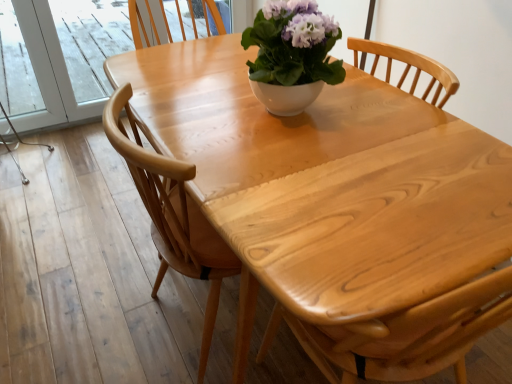
In order to face light wood chair at center, should I rotate leftwards or rightwards?

Turn left by 5.196 degrees to look at light wood chair at center.

Find the location of `natural wood table at center`. natural wood table at center is located at coordinates (328, 188).

You are a GUI agent. You are given a task and a screenshot of the screen. Output one action in this format:
    pyautogui.click(x=<x>, y=<y>)
    Task: Click on the light wood chair at center
    
    Given the screenshot: What is the action you would take?
    pyautogui.click(x=172, y=215)

Considering the relative sizes of light wood chair at center and natural wood table at center in the image provided, is light wood chair at center smaller than natural wood table at center?

Yes.

Could you tell me if light wood chair at center is turned towards natural wood table at center?

No, light wood chair at center is not aimed at natural wood table at center.

Based on the photo, is the surface of light wood chair at center in direct contact with natural wood table at center?

No.

How different are the orientations of light wood chair at center and natural wood table at center in degrees?

They differ by 90 degrees in their facing directions.

Between natural wood table at center and light wood chair at center, which one has larger width?

natural wood table at center.

Is natural wood table at center with light wood chair at center?

There is a gap between natural wood table at center and light wood chair at center.

From a real-world perspective, is natural wood table at center on top of light wood chair at center?

Indeed, from a real-world perspective, natural wood table at center stands above light wood chair at center.

Between white glossy bowl at center and light wood chair at center, which one has more height?

With more height is light wood chair at center.

In the scene shown: Between white glossy bowl at center and light wood chair at center, which one appears on the right side from the viewer's perspective?

From the viewer's perspective, white glossy bowl at center appears more on the right side.

Is white glossy bowl at center not within light wood chair at center?

Yes, white glossy bowl at center is located beyond the bounds of light wood chair at center.

Is white glossy bowl at center directly adjacent to light wood chair at center?

No, white glossy bowl at center is not next to light wood chair at center.

Is light wood chair at center turned away from white glossy bowl at center?

light wood chair at center is not turned away from white glossy bowl at center.

Is the position of light wood chair at center less distant than that of white glossy bowl at center?

Yes, light wood chair at center is closer to the viewer.

Can you confirm if light wood chair at center is positioned to the right of white glossy bowl at center?

In fact, light wood chair at center is to the left of white glossy bowl at center.

From a real-world perspective, which is physically below, light wood chair at center or white glossy bowl at center?

In real-world perspective, light wood chair at center is lower.

In the scene shown: Which is more to the left, natural wood table at center or white glossy bowl at center?

white glossy bowl at center is more to the left.

From a real-world perspective, which is physically below, natural wood table at center or white glossy bowl at center?

natural wood table at center, from a real-world perspective.

Is there a large distance between natural wood table at center and white glossy bowl at center?

They are positioned close to each other.

Find the location of `kitchen & dining room table in front of the white glossy bowl at center`. kitchen & dining room table in front of the white glossy bowl at center is located at coordinates (328, 188).

How much distance is there between white glossy bowl at center and natural wood table at center?

The distance of white glossy bowl at center from natural wood table at center is 8.80 inches.

Could you tell me if white glossy bowl at center is facing natural wood table at center?

Yes, white glossy bowl at center is aimed at natural wood table at center.

Considering the positions of objects white glossy bowl at center and natural wood table at center in the image provided, who is in front, white glossy bowl at center or natural wood table at center?

natural wood table at center is more forward.

Based on the photo, from a real-world perspective, which object rests below the other?

natural wood table at center is physically lower.

At what (x,y) coordinates should I click in order to perform the action: click on kitchen & dining room table that is in front of the light wood chair at center. Please return your answer as a coordinate pair (x, y). Looking at the image, I should click on (x=328, y=188).

The width and height of the screenshot is (512, 384). Find the location of `kitchen & dining room table that appears below the light wood chair at center (from the image's perspective)`. kitchen & dining room table that appears below the light wood chair at center (from the image's perspective) is located at coordinates (328, 188).

Looking at the image, which one is located closer to natural wood table at center, light wood chair at center or white glossy bowl at center?

The object closer to natural wood table at center is white glossy bowl at center.

Considering their positions, is white glossy bowl at center positioned closer to light wood chair at center than natural wood table at center?

natural wood table at center.

Looking at the image, which one is located closer to white glossy bowl at center, light wood chair at center or natural wood table at center?

The object closer to white glossy bowl at center is natural wood table at center.

Which object lies further to the anchor point natural wood table at center, white glossy bowl at center or light wood chair at center?

Based on the image, light wood chair at center appears to be further to natural wood table at center.

Based on their spatial positions, is natural wood table at center or light wood chair at center further from white glossy bowl at center?

light wood chair at center lies further to white glossy bowl at center than the other object.

Consider the image. Which object lies further to the anchor point light wood chair at center, natural wood table at center or white glossy bowl at center?

white glossy bowl at center is further to light wood chair at center.

The height and width of the screenshot is (384, 512). I want to click on chair between natural wood table at center and white glossy bowl at center along the z-axis, so [x=172, y=215].